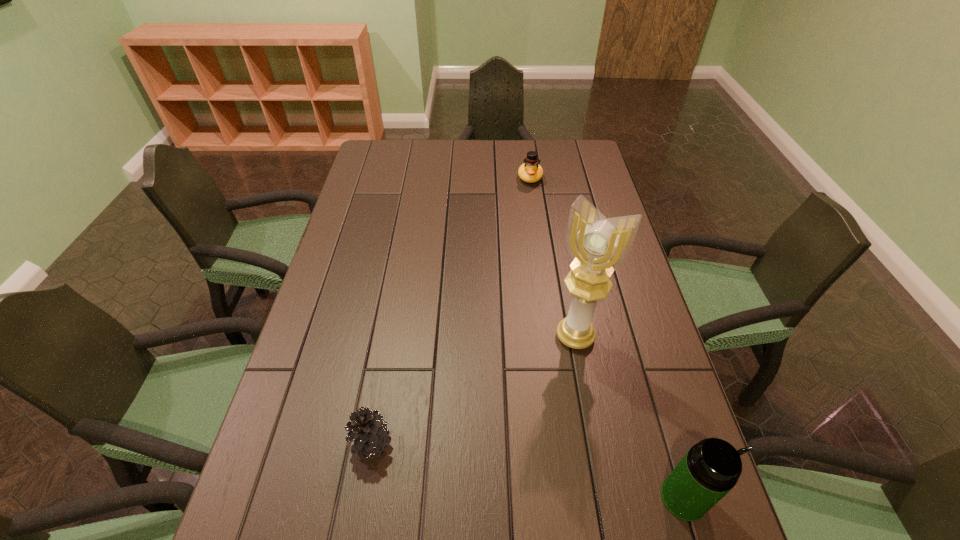
Where is `vacant spot on the desktop that is between the leftmost object and the second tallest object and is positioned on the front-facing side of the second farthest object`? Image resolution: width=960 pixels, height=540 pixels. vacant spot on the desktop that is between the leftmost object and the second tallest object and is positioned on the front-facing side of the second farthest object is located at coordinates (499, 465).

The image size is (960, 540). I want to click on free space on the desktop that is between the pinecone and the thermos bottle and is positioned on the front-facing side of the farthest object, so click(x=512, y=468).